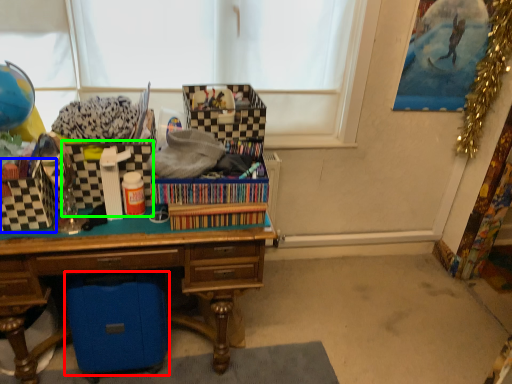
Question: Which object is positioned closest to storage box (highlighted by a red box)? Select from storage box (highlighted by a blue box) and storage box (highlighted by a green box).

Choices:
 (A) storage box
 (B) storage box

Answer: (A)